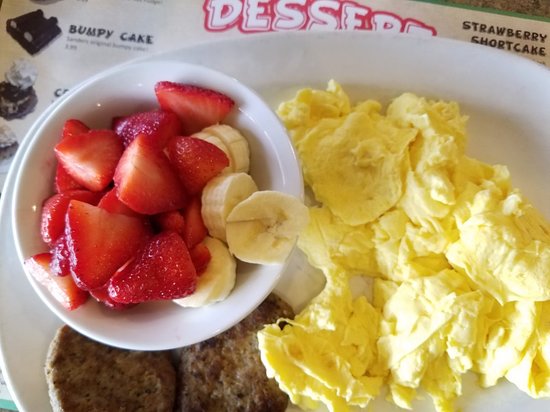
Where is `placemat`? This screenshot has width=550, height=412. placemat is located at coordinates (279, 19).